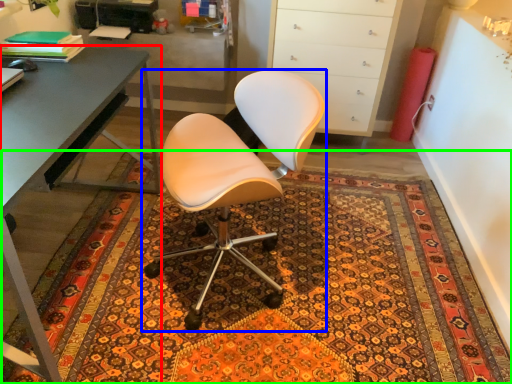
Question: Which object is the farthest from desk (highlighted by a red box)? Choose among these: chair (highlighted by a blue box) or doormat (highlighted by a green box).

Choices:
 (A) chair
 (B) doormat

Answer: (B)